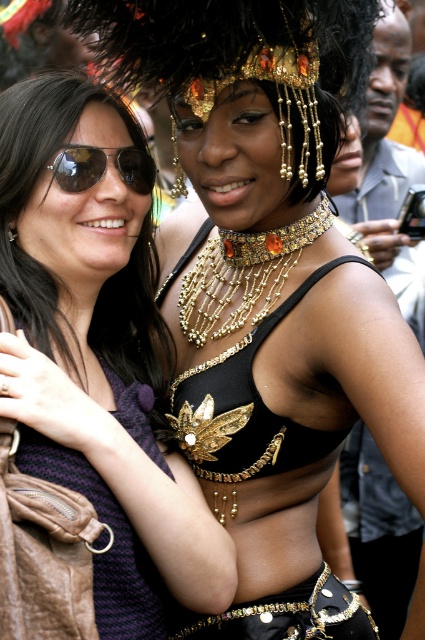
Can you confirm if gold beaded crown at upper center is thinner than sunglasses at left?

No, gold beaded crown at upper center is not thinner than sunglasses at left.

Who is shorter, gold beaded crown at upper center or sunglasses at left?

gold beaded crown at upper center

Where is `gold beaded crown at upper center`? gold beaded crown at upper center is located at coordinates (244, 61).

Locate an element on the screen. gold beaded crown at upper center is located at coordinates (244, 61).

From the picture: Who is more distant from viewer, (303, 109) or (98, 157)?

Point (98, 157)

Find the location of a particular element. The image size is (425, 640). gold beaded crown at upper center is located at coordinates (244, 61).

Can you confirm if sunglasses at left is taller than shiny black sunglasses at upper left?

Indeed, sunglasses at left has a greater height compared to shiny black sunglasses at upper left.

Is point (54, 148) closer to viewer compared to point (102, 164)?

Yes, point (54, 148) is in front of point (102, 164).

At what (x,y) coordinates should I click in order to perform the action: click on sunglasses at left. Please return your answer as a coordinate pair (x, y). The image size is (425, 640). Looking at the image, I should click on (34, 184).